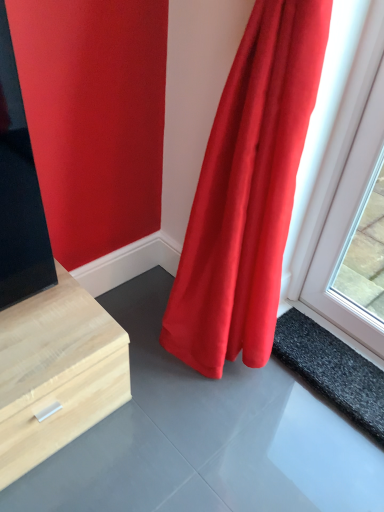
The width and height of the screenshot is (384, 512). Describe the element at coordinates (247, 191) in the screenshot. I see `matte red curtain at right` at that location.

I want to click on matte red curtain at right, so click(247, 191).

The width and height of the screenshot is (384, 512). What do you see at coordinates (332, 370) in the screenshot?
I see `black rubber mat at lower right` at bounding box center [332, 370].

Identify the location of black rubber mat at lower right. This screenshot has height=512, width=384. (332, 370).

Identify the location of matte red curtain at right. (x=247, y=191).

Considering the positions of objects black rubber mat at lower right and matte red curtain at right in the image provided, who is more to the right, black rubber mat at lower right or matte red curtain at right?

black rubber mat at lower right is more to the right.

Considering the positions of objects black rubber mat at lower right and matte red curtain at right in the image provided, who is in front, black rubber mat at lower right or matte red curtain at right?

matte red curtain at right.

Is point (376, 436) more distant than point (237, 189)?

Yes.

From the image's perspective, which is above, black rubber mat at lower right or matte red curtain at right?

matte red curtain at right is shown above in the image.

From a real-world perspective, is black rubber mat at lower right physically located above or below matte red curtain at right?

black rubber mat at lower right is situated lower than matte red curtain at right in the real world.

Which object is wider, black rubber mat at lower right or matte red curtain at right?

Wider between the two is matte red curtain at right.

Considering the relative sizes of black rubber mat at lower right and matte red curtain at right in the image provided, is black rubber mat at lower right shorter than matte red curtain at right?

Yes.

Based on their sizes in the image, would you say black rubber mat at lower right is bigger or smaller than matte red curtain at right?

black rubber mat at lower right is smaller than matte red curtain at right.

Is matte red curtain at right inside black rubber mat at lower right?

No, black rubber mat at lower right does not contain matte red curtain at right.

Is black rubber mat at lower right far away from matte red curtain at right?

Actually, black rubber mat at lower right and matte red curtain at right are a little close together.

Could you tell me if black rubber mat at lower right is turned towards matte red curtain at right?

Yes.

How many degrees apart are the facing directions of black rubber mat at lower right and matte red curtain at right?

The facing directions of black rubber mat at lower right and matte red curtain at right are 1.85 degrees apart.

How distant is black rubber mat at lower right from matte red curtain at right?

black rubber mat at lower right is 41.02 centimeters from matte red curtain at right.

Locate an element on the screen. Image resolution: width=384 pixels, height=512 pixels. slate below the matte red curtain at right (from the image's perspective) is located at coordinates (332, 370).

Would you say matte red curtain at right is to the left or to the right of black rubber mat at lower right in the picture?

Clearly, matte red curtain at right is on the left of black rubber mat at lower right in the image.

Which object is closer to the camera, matte red curtain at right or black rubber mat at lower right?

matte red curtain at right is in front.

Is point (263, 48) positioned after point (359, 397)?

No, (263, 48) is closer to viewer.

From the image's perspective, relative to black rubber mat at lower right, is matte red curtain at right above or below?

Clearly, from the image's perspective, matte red curtain at right is above black rubber mat at lower right.

From a real-world perspective, who is located higher, matte red curtain at right or black rubber mat at lower right?

matte red curtain at right.

Considering the sizes of objects matte red curtain at right and black rubber mat at lower right in the image provided, who is wider, matte red curtain at right or black rubber mat at lower right?

With larger width is matte red curtain at right.

Considering the relative sizes of matte red curtain at right and black rubber mat at lower right in the image provided, is matte red curtain at right shorter than black rubber mat at lower right?

No.

Considering the relative sizes of matte red curtain at right and black rubber mat at lower right in the image provided, is matte red curtain at right bigger than black rubber mat at lower right?

Yes, matte red curtain at right is bigger than black rubber mat at lower right.

Is matte red curtain at right inside or outside of black rubber mat at lower right?

matte red curtain at right exists outside the volume of black rubber mat at lower right.

Are matte red curtain at right and black rubber mat at lower right far apart?

They are positioned close to each other.

Is black rubber mat at lower right at the back of matte red curtain at right?

Absolutely, matte red curtain at right is directed away from black rubber mat at lower right.

Where is `slate on the right of matte red curtain at right`? This screenshot has width=384, height=512. slate on the right of matte red curtain at right is located at coordinates (332, 370).

This screenshot has width=384, height=512. What are the coordinates of `slate that is under the matte red curtain at right (from a real-world perspective)` in the screenshot? It's located at (332, 370).

At what (x,y) coordinates should I click in order to perform the action: click on curtain in front of the black rubber mat at lower right. Please return your answer as a coordinate pair (x, y). The width and height of the screenshot is (384, 512). Looking at the image, I should click on (247, 191).